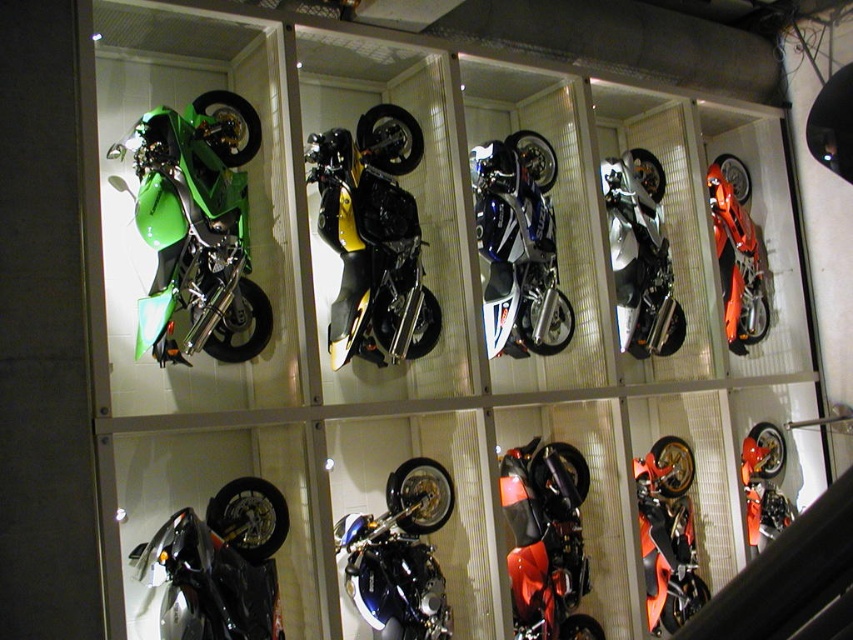
You are standing in front of the motorcycle display case. You see two shiny orange motorcycles. The first is labeled as the shiny orange motorcycle at bottom right and the second is the shiny orange motorcycle at lower right. Which one is positioned to the left of the other?

The shiny orange motorcycle at bottom right is positioned to the left of the shiny orange motorcycle at lower right.